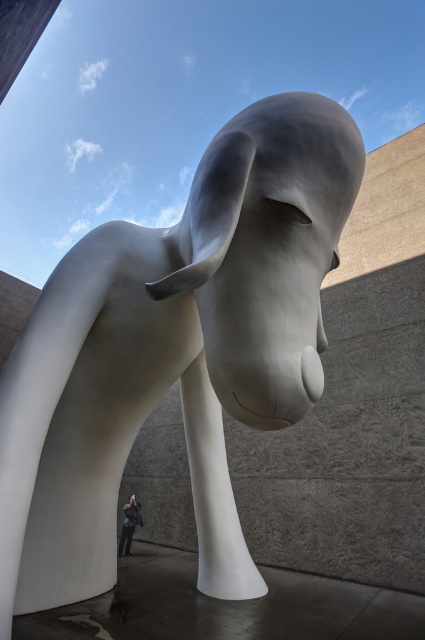
Does white glossy sculpture at center appear on the left side of satin silver sculpture at center?

Indeed, white glossy sculpture at center is positioned on the left side of satin silver sculpture at center.

At what (x,y) coordinates should I click in order to perform the action: click on white glossy sculpture at center. Please return your answer as a coordinate pair (x, y). The width and height of the screenshot is (425, 640). Looking at the image, I should click on (173, 349).

From the picture: Does satin silver sculpture at center appear on the right side of blue fabric jacket at lower center?

Yes, satin silver sculpture at center is to the right of blue fabric jacket at lower center.

Can you confirm if satin silver sculpture at center is taller than blue fabric jacket at lower center?

Yes, satin silver sculpture at center is taller than blue fabric jacket at lower center.

Does point (323, 129) come closer to viewer compared to point (133, 508)?

Yes, point (323, 129) is in front of point (133, 508).

The height and width of the screenshot is (640, 425). Identify the location of satin silver sculpture at center. (x=266, y=250).

Who is more distant from viewer, (204, 316) or (124, 520)?

Point (124, 520)

Between white glossy sculpture at center and blue fabric jacket at lower center, which one appears on the right side from the viewer's perspective?

Positioned to the right is white glossy sculpture at center.

Which is behind, point (132, 250) or point (121, 541)?

Positioned behind is point (121, 541).

Where is `white glossy sculpture at center`? This screenshot has height=640, width=425. white glossy sculpture at center is located at coordinates (173, 349).